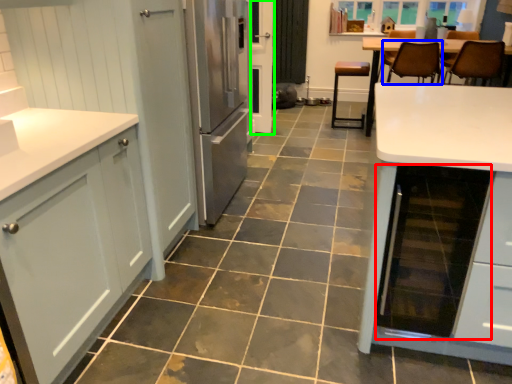
Question: Considering the real-world distances, which object is farthest from appliance (highlighted by a red box)? chair (highlighted by a blue box) or screen door (highlighted by a green box)?

Choices:
 (A) chair
 (B) screen door

Answer: (B)